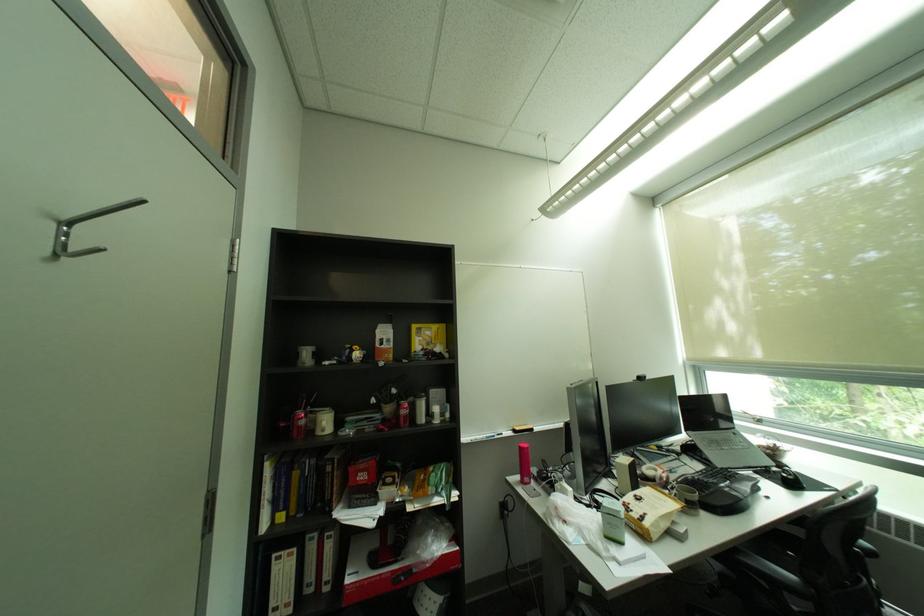
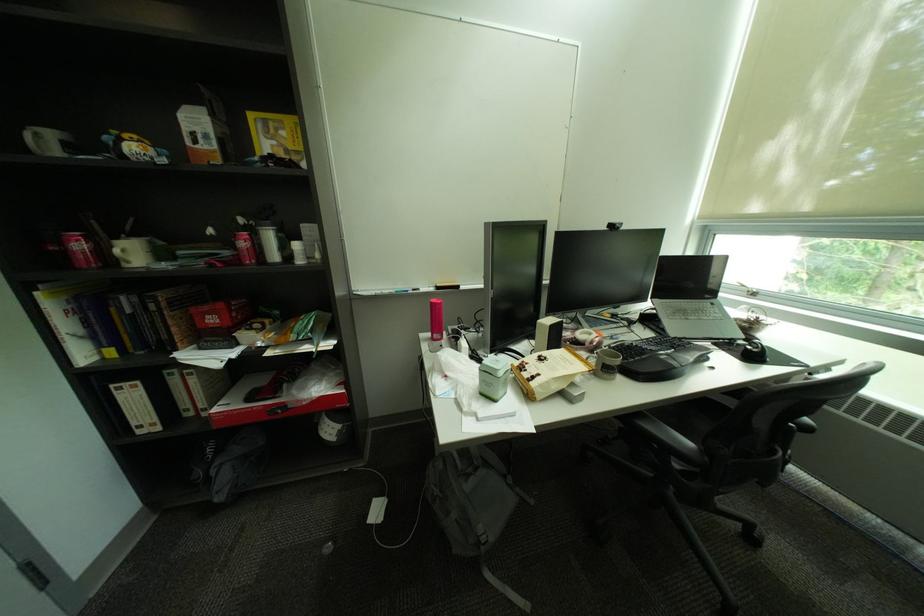
In the second image, find the point that corresponds to point 618,539 in the first image.

(492, 395)